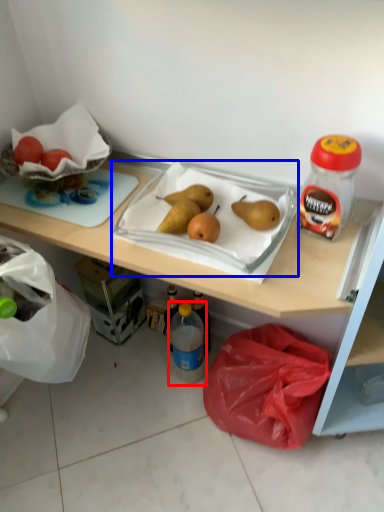
Question: Which object appears closest to the camera in this image, bottle (highlighted by a red box) or wide (highlighted by a blue box)?

Choices:
 (A) bottle
 (B) wide

Answer: (B)